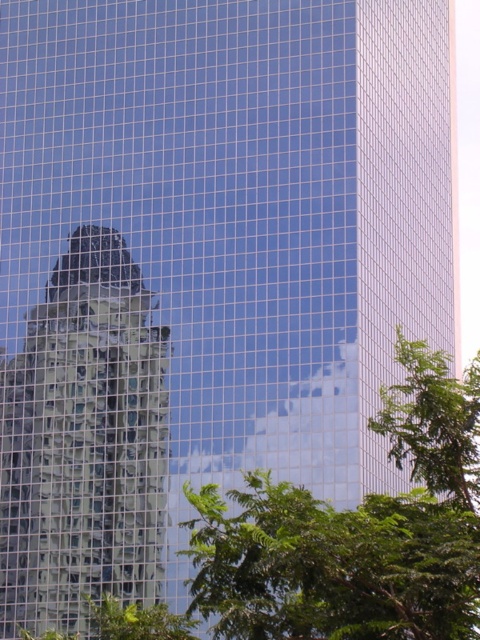
You are standing in front of the reflective glass building at center and want to take a photo of the green leafy tree at center. Can you see the tree through the building?

The green leafy tree at center is behind the reflective glass building at center, so you cannot see the tree through the building.

You are an architect analyzing the image. You notice the reflective glass building at center and the green leafy tree at center. Which object has a narrower width?

Result: The reflective glass building at center is thinner than the green leafy tree at center, so the reflective glass building at center has a narrower width.